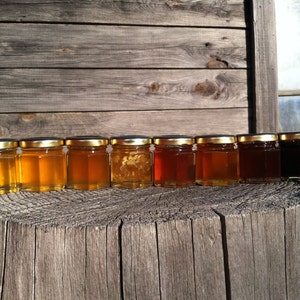
In order to click on jars containing dark golden substance in this screenshot , I will do `click(216, 163)`, `click(174, 163)`.